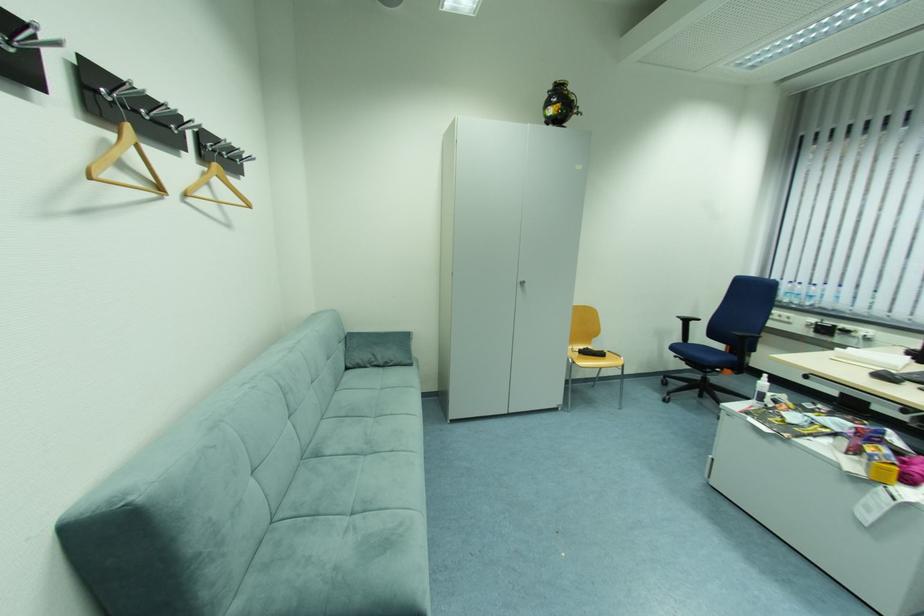
At what (x,y) coordinates should I click in order to perform the action: click on yellow chair sitting surface. Please return your answer as a coordinate pair (x, y). Looking at the image, I should click on (593, 359).